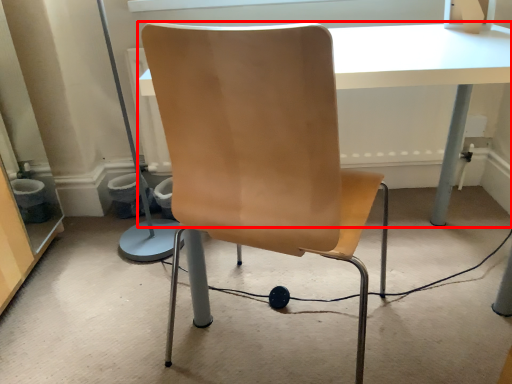
Question: From the image's perspective, considering the relative positions of table (annotated by the red box) and chair in the image provided, where is table (annotated by the red box) located with respect to the staircase?

Choices:
 (A) above
 (B) below

Answer: (A)